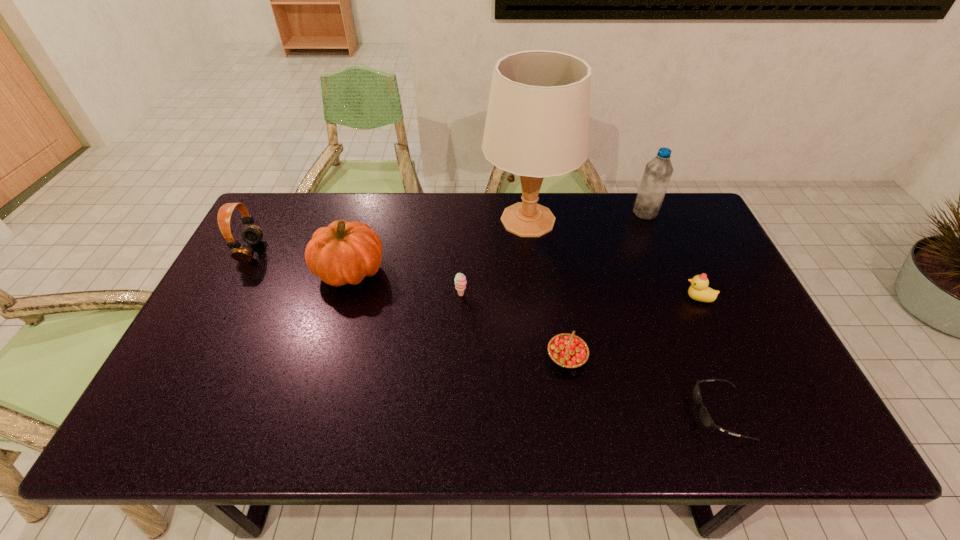
You are a GUI agent. You are given a task and a screenshot of the screen. Output one action in this format:
    pyautogui.click(x=<x>, y=<y>)
    Task: Click on the vacant space that's between the sunglasses and the pumpkin
    This screenshot has width=960, height=540.
    Given the screenshot: What is the action you would take?
    pyautogui.click(x=536, y=342)

Identify the location of blank region between the table lamp and the second tallest object. The height and width of the screenshot is (540, 960). (587, 217).

At what (x,y) coordinates should I click in order to perform the action: click on free space between the headset and the seventh object from right to left. Please return your answer as a coordinate pair (x, y). The height and width of the screenshot is (540, 960). Looking at the image, I should click on (300, 261).

Where is `free space between the seventh shortest object and the nearest object`? This screenshot has height=540, width=960. free space between the seventh shortest object and the nearest object is located at coordinates (683, 313).

Identify the location of empty location between the strawberry and the sixth object from right to left. (514, 326).

Where is `free space between the duckling and the table lamp`? The width and height of the screenshot is (960, 540). free space between the duckling and the table lamp is located at coordinates click(612, 259).

Identify which object is located as the seventh nearest to the duckling. Please provide its 2D coordinates. Your answer should be formatted as a tuple, i.e. [(x, y)], where the tuple contains the x and y coordinates of a point satisfying the conditions above.

[(252, 234)]

What are the coordinates of `the second closest object to the nearest object` in the screenshot? It's located at (699, 290).

At what (x,y) coordinates should I click in order to perform the action: click on free region that satisfies the following two spatial constraints: 1. on the back side of the water bottle; 2. on the left side of the table lamp. Please return your answer as a coordinate pair (x, y). Looking at the image, I should click on (527, 213).

You are a GUI agent. You are given a task and a screenshot of the screen. Output one action in this format:
    pyautogui.click(x=<x>, y=<y>)
    Task: Click on the vacant space that satisfies the following two spatial constraints: 1. on the back side of the tallest object; 2. on the left side of the second tallest object
    This screenshot has width=960, height=540.
    Given the screenshot: What is the action you would take?
    pyautogui.click(x=527, y=213)